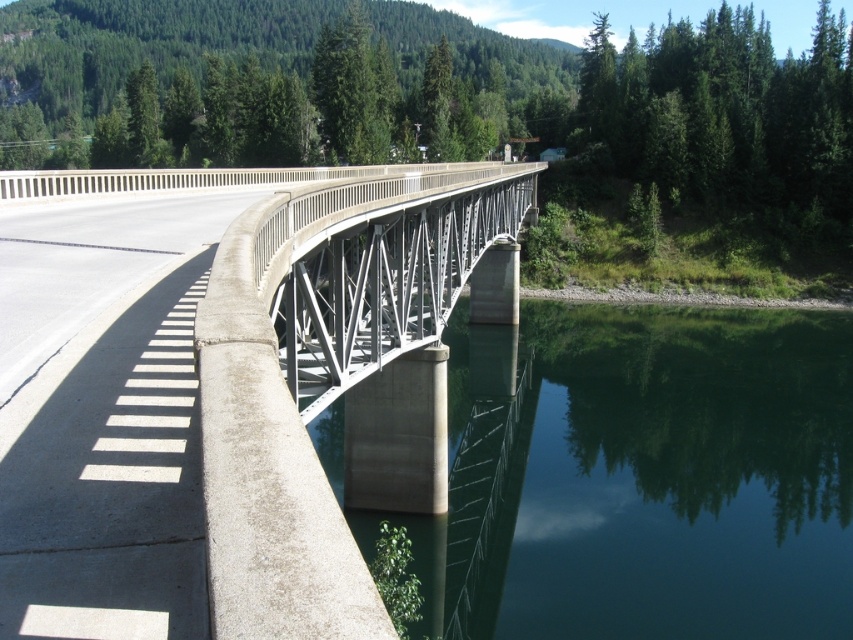
You are standing on the concrete bridge and looking down. There is a point marked as point (646, 480). What is the object located at that point?

The point (646, 480) corresponds to the green smooth water at lower center.

You are standing on the concrete bridge and want to find the green smooth water at lower center. According to the coordinates provided, where exactly should you look to spot it?

The green smooth water at lower center is located at point (646, 480), so you should look towards the lower center area of the bridge where those coordinates intersect.